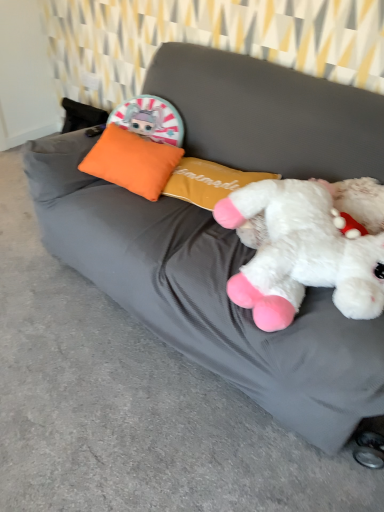
Question: From a real-world perspective, is white plush toy at right under orange fabric pillow at upper left?

Choices:
 (A) yes
 (B) no

Answer: (B)

Question: Considering the relative sizes of white plush toy at right and orange fabric pillow at upper left in the image provided, is white plush toy at right smaller than orange fabric pillow at upper left?

Choices:
 (A) yes
 (B) no

Answer: (B)

Question: Does white plush toy at right have a larger size compared to orange fabric pillow at upper left?

Choices:
 (A) yes
 (B) no

Answer: (A)

Question: Considering the relative sizes of white plush toy at right and orange fabric pillow at upper left in the image provided, is white plush toy at right shorter than orange fabric pillow at upper left?

Choices:
 (A) yes
 (B) no

Answer: (B)

Question: Is white plush toy at right to the left of orange fabric pillow at upper left from the viewer's perspective?

Choices:
 (A) no
 (B) yes

Answer: (A)

Question: Is orange fabric pillow at upper left completely or partially inside white plush toy at right?

Choices:
 (A) no
 (B) yes

Answer: (A)

Question: Is there a large distance between orange fabric pillow at upper left and white plush toy at right?

Choices:
 (A) yes
 (B) no

Answer: (B)

Question: Considering the relative positions of orange fabric pillow at upper left and white plush toy at right in the image provided, is orange fabric pillow at upper left to the left of white plush toy at right from the viewer's perspective?

Choices:
 (A) yes
 (B) no

Answer: (A)

Question: Does orange fabric pillow at upper left have a larger size compared to white plush toy at right?

Choices:
 (A) yes
 (B) no

Answer: (B)

Question: Considering the relative sizes of orange fabric pillow at upper left and white plush toy at right in the image provided, is orange fabric pillow at upper left shorter than white plush toy at right?

Choices:
 (A) yes
 (B) no

Answer: (A)

Question: From the image's perspective, would you say orange fabric pillow at upper left is shown under white plush toy at right?

Choices:
 (A) yes
 (B) no

Answer: (B)

Question: Does orange fabric pillow at upper left touch white plush toy at right?

Choices:
 (A) no
 (B) yes

Answer: (A)

Question: Is orange fabric pillow at upper left taller or shorter than white plush toy at right?

Choices:
 (A) short
 (B) tall

Answer: (A)